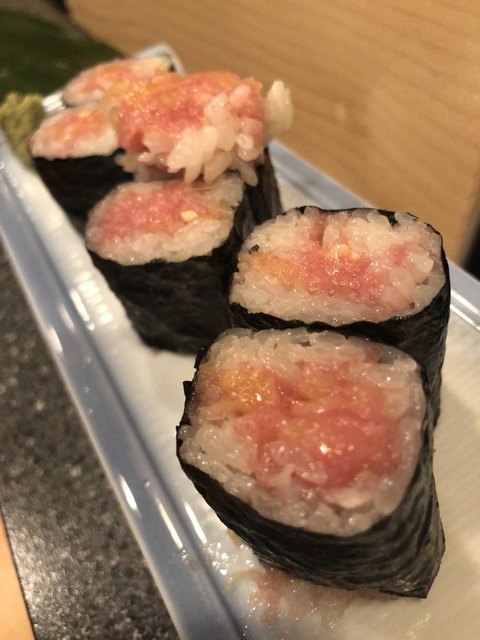
Where is `plate`? Image resolution: width=480 pixels, height=640 pixels. plate is located at coordinates (167, 454).